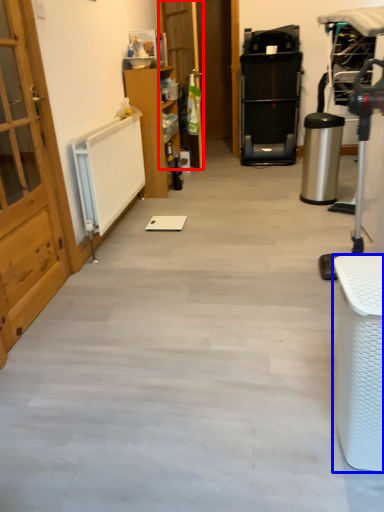
Question: Among these objects, which one is nearest to the camera, door (highlighted by a red box) or furniture (highlighted by a blue box)?

Choices:
 (A) door
 (B) furniture

Answer: (B)